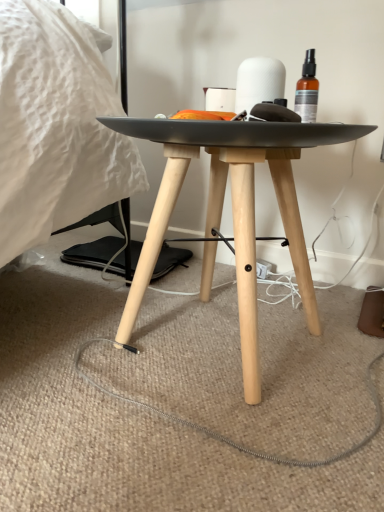
Identify the location of vacant area situated to the left side of matte black table at center. (56, 326).